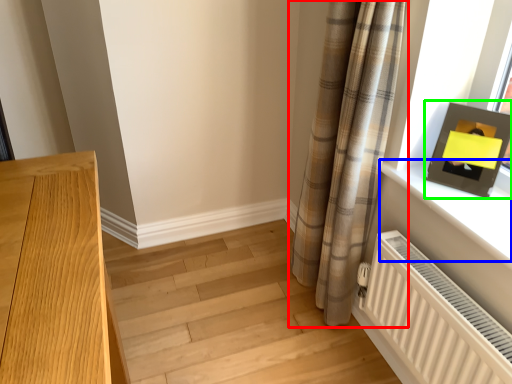
Question: Which object is positioned farthest from curtain (highlighted by a red box)? Select from window sill (highlighted by a blue box) and picture frame (highlighted by a green box).

Choices:
 (A) window sill
 (B) picture frame

Answer: (B)